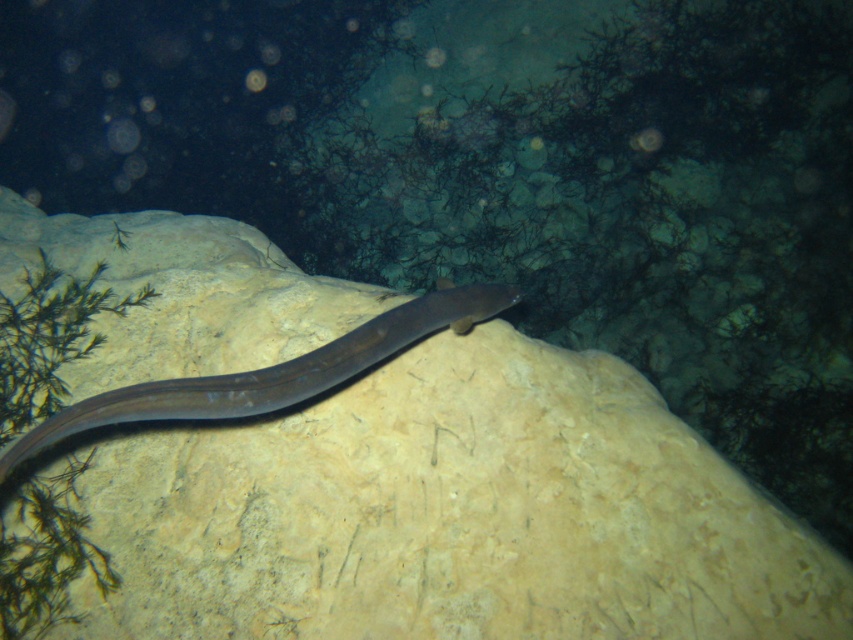
Question: Is smooth beige rock at center to the left of smooth gray snake at center from the viewer's perspective?

Choices:
 (A) no
 (B) yes

Answer: (B)

Question: Does smooth beige rock at center have a smaller size compared to smooth gray snake at center?

Choices:
 (A) yes
 (B) no

Answer: (B)

Question: Which point is closer to the camera?

Choices:
 (A) smooth gray snake at center
 (B) smooth beige rock at center

Answer: (B)

Question: Is smooth beige rock at center bigger than smooth gray snake at center?

Choices:
 (A) no
 (B) yes

Answer: (B)